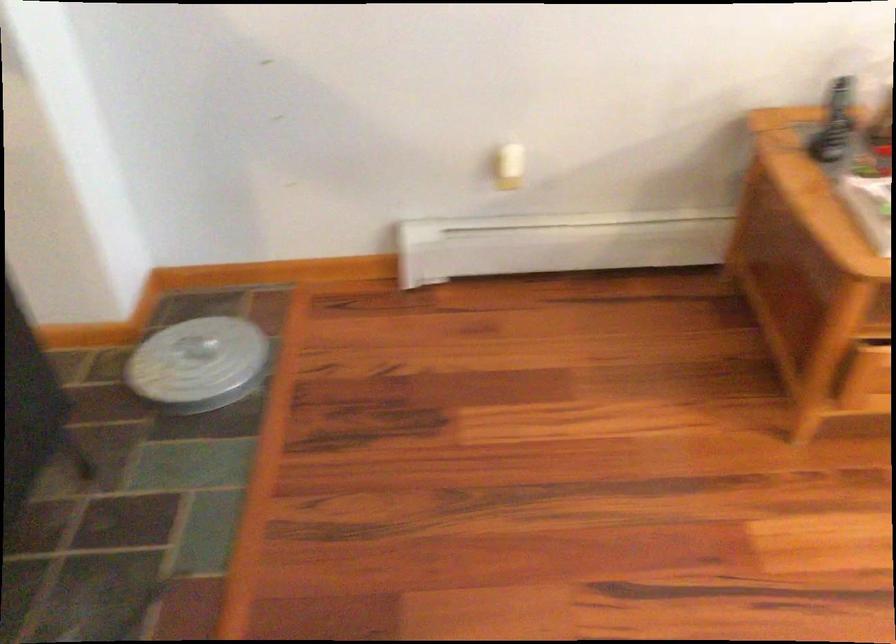
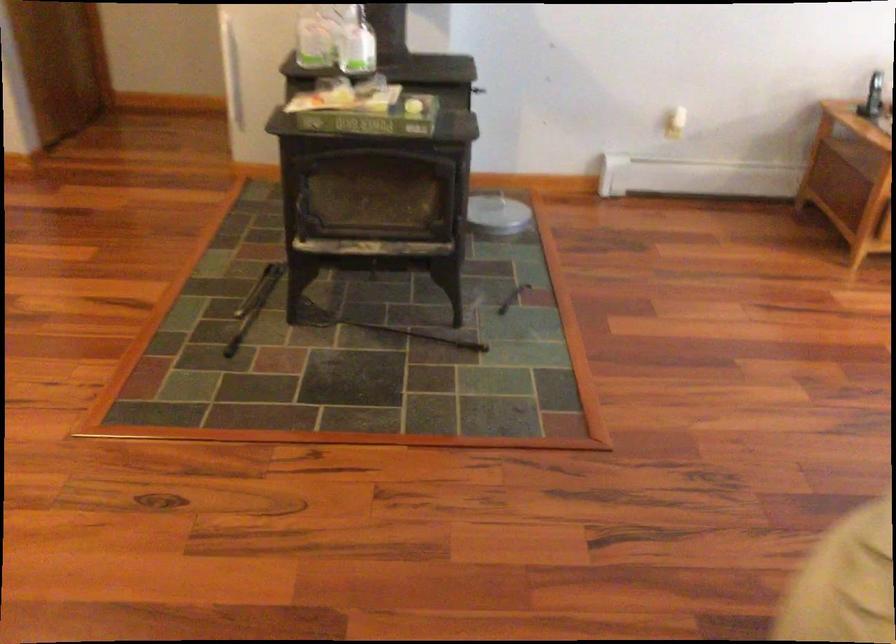
Where in the second image is the point corresponding to the point at 185,138 from the first image?

(477, 90)